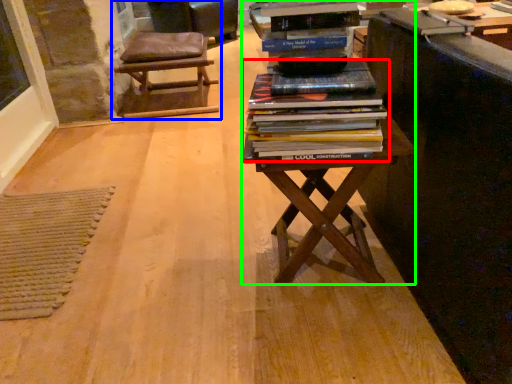
Question: Which object is the closest to the book (highlighted by a red box)? Choose among these: chair (highlighted by a blue box) or table (highlighted by a green box).

Choices:
 (A) chair
 (B) table

Answer: (B)